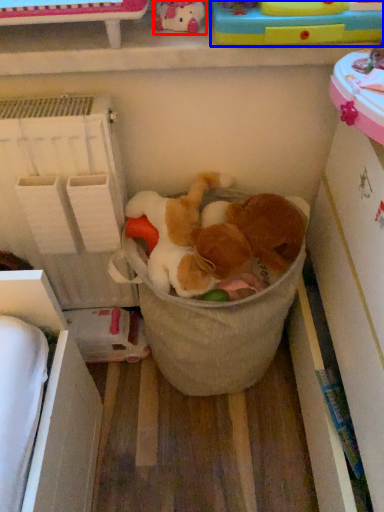
Question: Among these objects, which one is farthest to the camera, toy (highlighted by a red box) or toy (highlighted by a blue box)?

Choices:
 (A) toy
 (B) toy

Answer: (B)